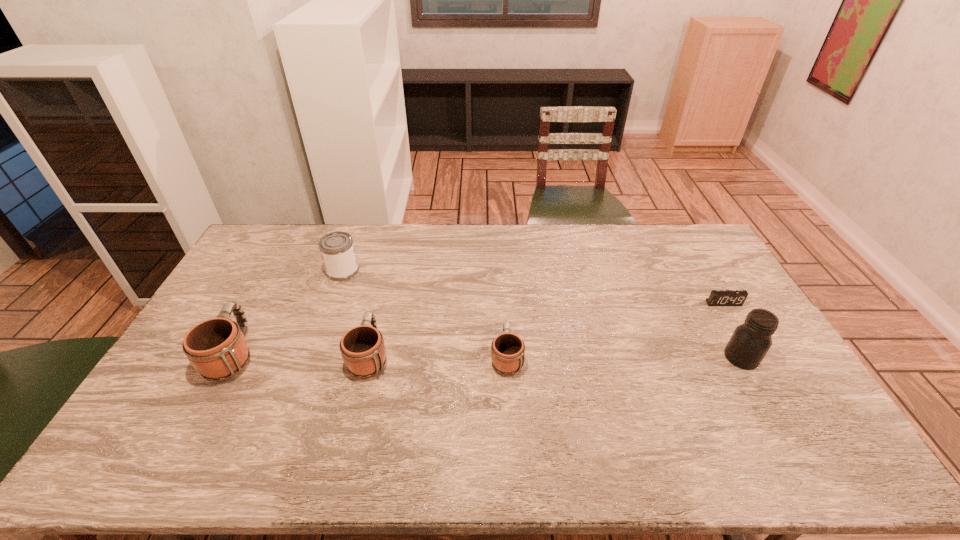
The image size is (960, 540). I want to click on jar, so click(750, 342).

Locate an element on the screen. Image resolution: width=960 pixels, height=540 pixels. vacant area located on the side of the leftmost object with the handle is located at coordinates (267, 292).

Identify the location of vacant space located 0.390m on the side of the leftmost object with the handle. (288, 251).

Where is `blank space located on the side of the leftmost object with the handle`? Image resolution: width=960 pixels, height=540 pixels. blank space located on the side of the leftmost object with the handle is located at coordinates (282, 262).

The width and height of the screenshot is (960, 540). In order to click on vacant space located 0.100m on the side of the third object from left to right with the handle in this screenshot , I will do `click(380, 309)`.

Where is `free space located 0.280m on the side of the third object from left to right with the handle`? The height and width of the screenshot is (540, 960). free space located 0.280m on the side of the third object from left to right with the handle is located at coordinates (389, 273).

You are a GUI agent. You are given a task and a screenshot of the screen. Output one action in this format:
    pyautogui.click(x=<x>, y=<y>)
    Task: Click on the blank space located on the side of the third object from left to right with the handle
    The image size is (960, 540).
    Given the screenshot: What is the action you would take?
    pyautogui.click(x=387, y=282)

Image resolution: width=960 pixels, height=540 pixels. In order to click on free space located 0.100m on the side of the shortest mug with the handle in this screenshot , I will do `click(504, 314)`.

Where is `free location located on the side of the shortest mug with the handle`? This screenshot has width=960, height=540. free location located on the side of the shortest mug with the handle is located at coordinates (504, 303).

Locate an element on the screen. Image resolution: width=960 pixels, height=540 pixels. free region located 0.230m on the side of the shortest mug with the handle is located at coordinates (503, 287).